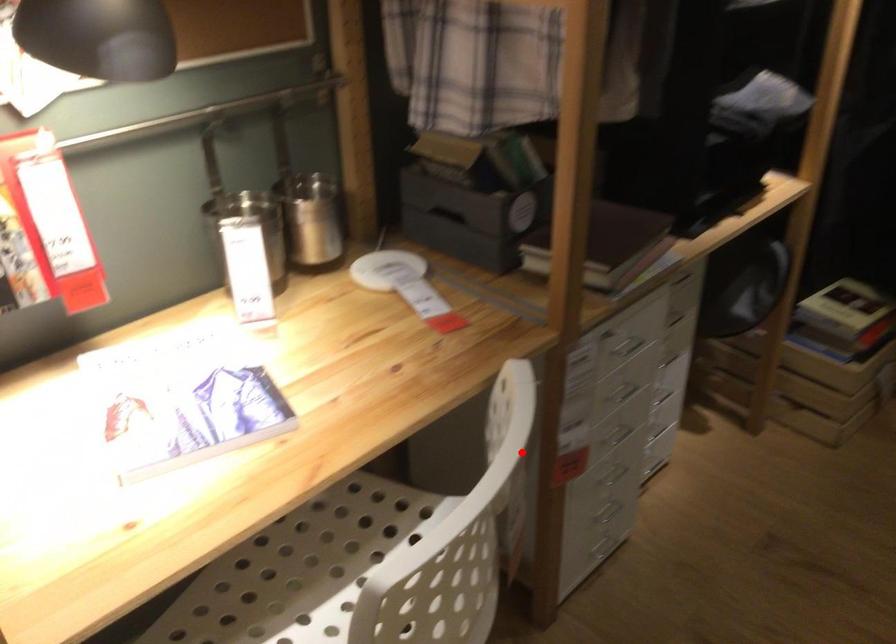
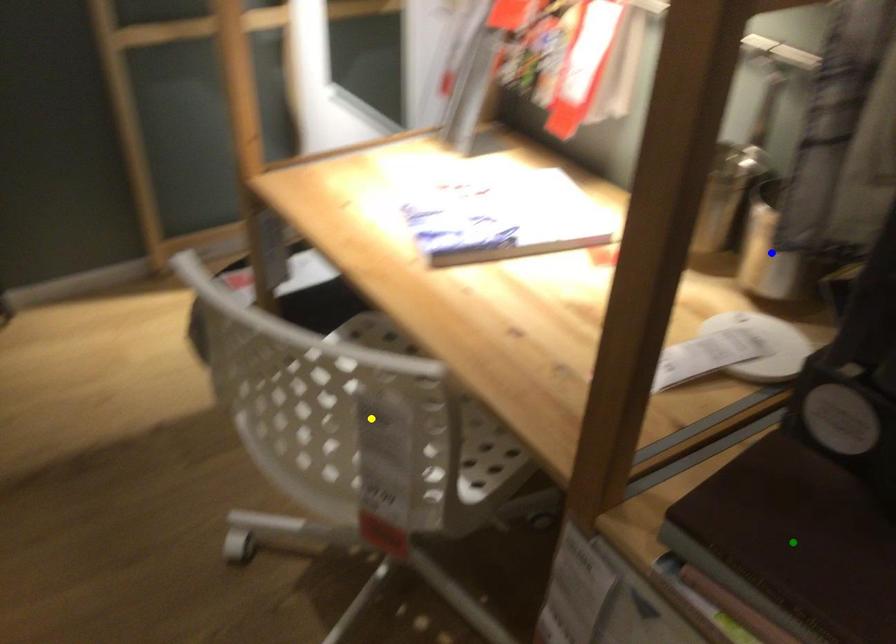
Question: I am providing you with two images of the same scene from different viewpoints. A red point is marked on the first image. You are given multiple points on the second image. Can you choose the point in image 2 that corresponds to the point in image 1?

Choices:
 (A) yellow point
 (B) blue point
 (C) green point

Answer: (A)